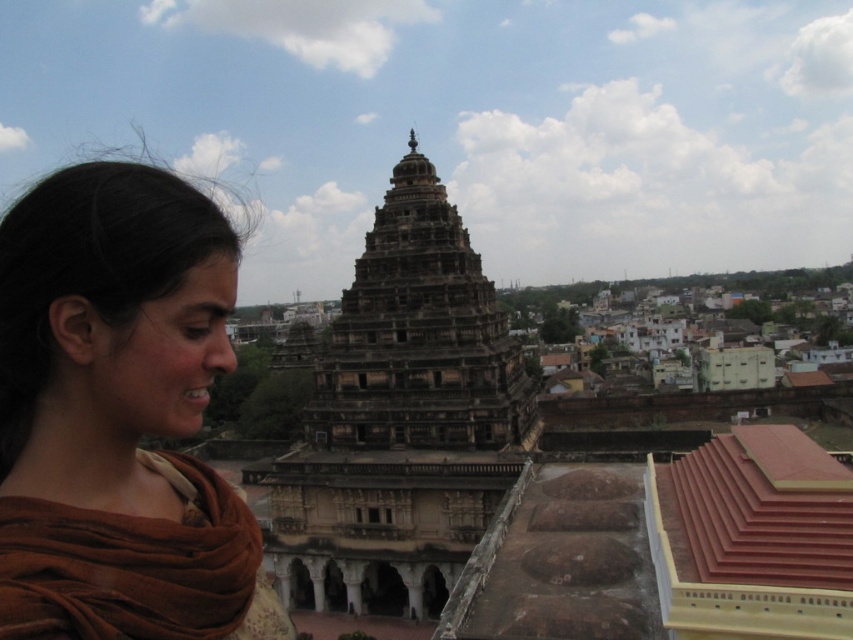
Looking at this image, is brown fabric at left below dark brown stone tower at center?

No.

Looking at this image, is brown fabric at left taller than dark brown stone tower at center?

Incorrect, brown fabric at left's height is not larger of dark brown stone tower at center's.

Is point (152, 321) more distant than point (339, 371)?

No, it is not.

Locate an element on the screen. The width and height of the screenshot is (853, 640). brown fabric at left is located at coordinates (115, 412).